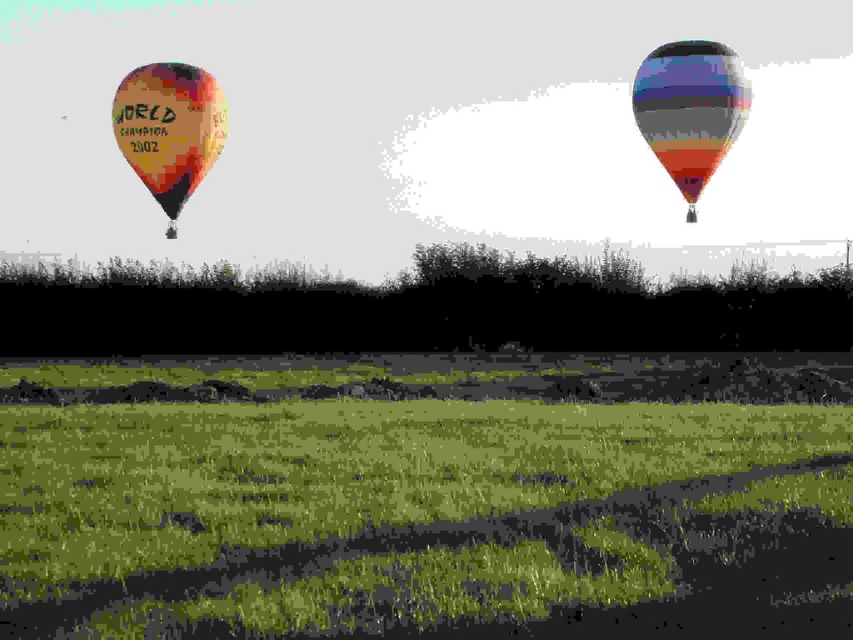
You are standing on the grassy field looking up at the two hot air balloons. You notice two specific points marked on the balloons. The first point is at coordinates point (x=328, y=540) and the second is at point (x=672, y=49). From your vantage point, which point appears closer to you?

Point (x=328, y=540) is in front of point (x=672, y=49), so the first point appears closer to you.

You are standing on the grassy field looking up at the two hot air balloons. The multicolored striped balloon at upper right has a point marked at coordinates (689,109). Is this point located on the balloon with the inscription

The point (689,109) is on the multicolored striped balloon at upper right, which does have the inscription

You are standing on the green grassy field at lower center and want to look up at the multicolored fabric balloon at left. Which direction should you turn your head to see it?

You should turn your head to the left to see the multicolored fabric balloon at left since the green grassy field at lower center is closer to you, and the balloon is positioned to the left side of the image.